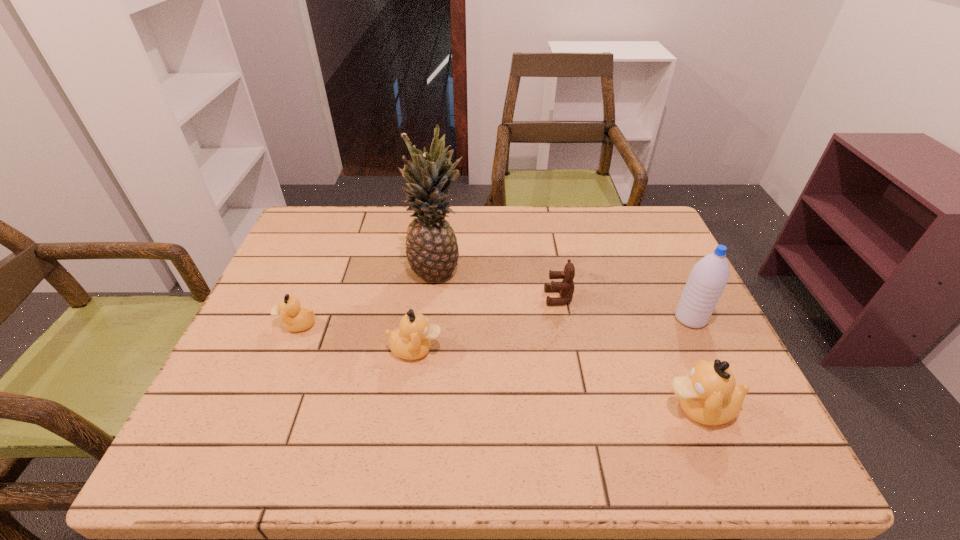
Identify the location of object that is at the left edge. This screenshot has height=540, width=960. (295, 318).

You are a GUI agent. You are given a task and a screenshot of the screen. Output one action in this format:
    pyautogui.click(x=<x>, y=<y>)
    Task: Click on the duckling at the right edge
    The height and width of the screenshot is (540, 960).
    Given the screenshot: What is the action you would take?
    pyautogui.click(x=709, y=395)

Find the location of a particular element. This screenshot has height=540, width=960. water bottle that is at the right edge is located at coordinates (708, 278).

Find the location of a particular element. Image resolution: width=960 pixels, height=540 pixels. object that is at the near right corner is located at coordinates (709, 395).

Identify the location of free region at the far edge of the desktop. (406, 231).

Identify the location of vacant region at the near edge. (447, 416).

The width and height of the screenshot is (960, 540). I want to click on vacant space at the left edge of the desktop, so click(x=282, y=368).

In the image, there is a desktop. Where is `vacant space at the right edge`? The image size is (960, 540). vacant space at the right edge is located at coordinates tap(729, 361).

Image resolution: width=960 pixels, height=540 pixels. Find the location of `vacant region at the far left corner of the desktop`. vacant region at the far left corner of the desktop is located at coordinates (329, 252).

Identify the location of vacant space that is in between the tallest duckling and the leftmost duckling. The height and width of the screenshot is (540, 960). (498, 366).